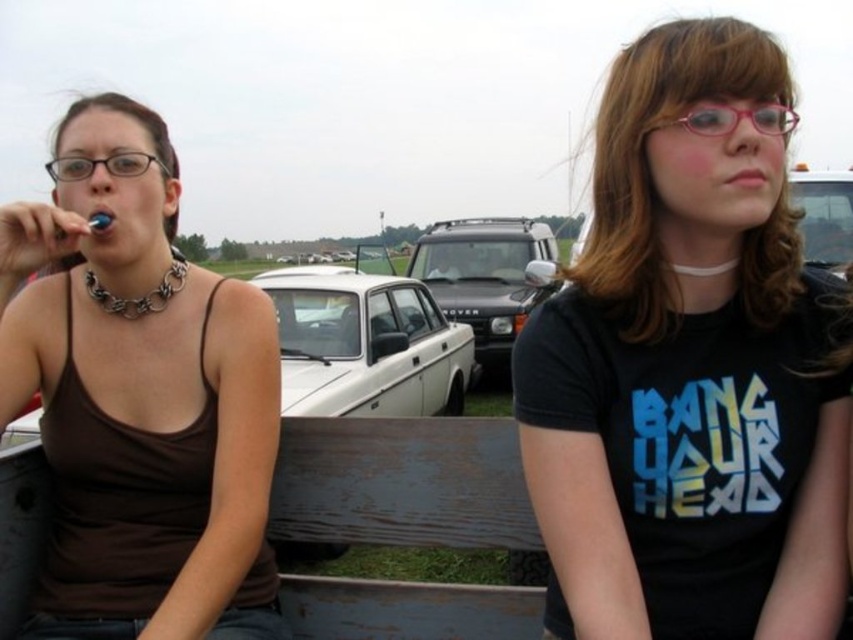
You are a delivery person needing to place a package between the white matte sedan at center and the silver metallic chain at left. The package requires 10 feet of space. Can you fit it there?

The white matte sedan at center and the silver metallic chain at left are 12.01 feet apart from each other, so yes, the package requiring 10 feet of space can fit between them.